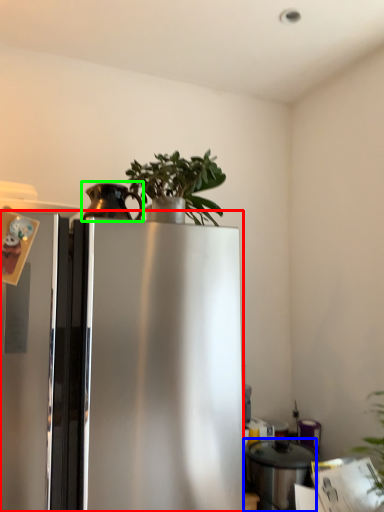
Question: Estimate the real-world distances between objects in this image. Which object is farther from refrigerator (highlighted by a red box), appliance (highlighted by a blue box) or appliance (highlighted by a green box)?

Choices:
 (A) appliance
 (B) appliance

Answer: (A)